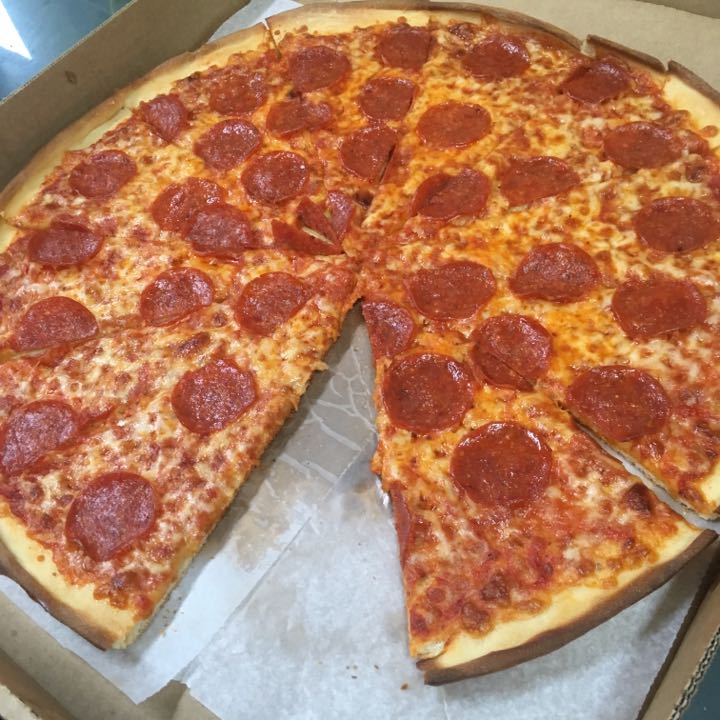
This screenshot has height=720, width=720. I want to click on light, so click(3, 32).